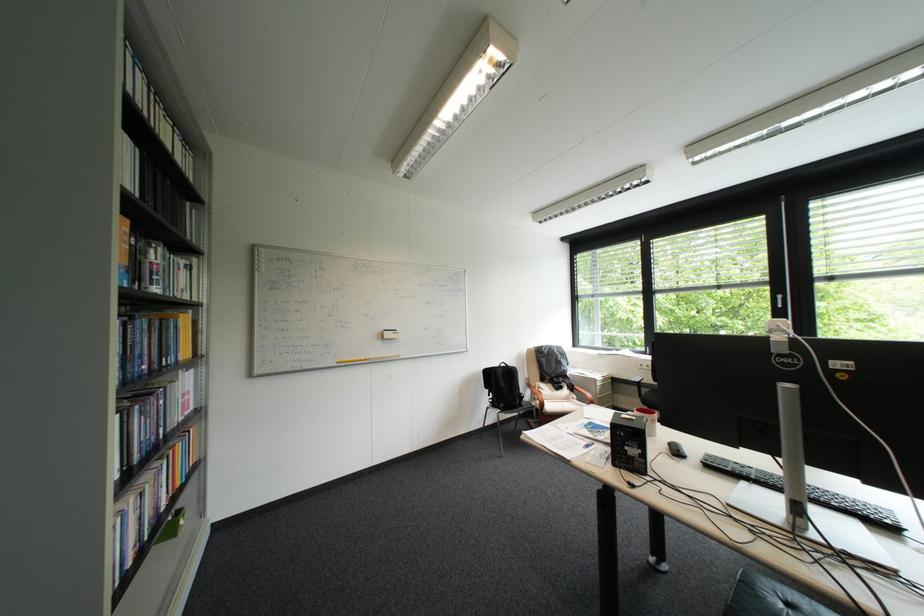
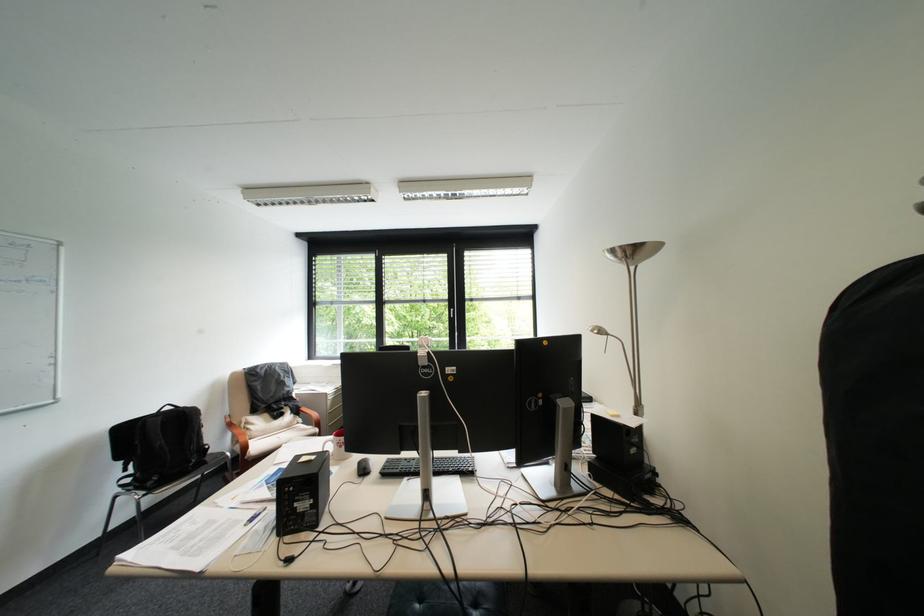
In the second image, find the point that corresponds to (549,387) in the first image.

(256, 424)